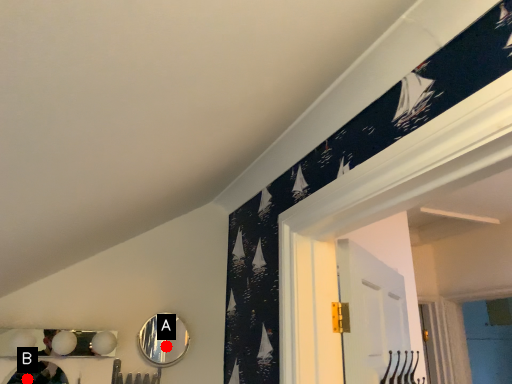
Question: Two points are circled on the image, labeled by A and B beside each circle. Which point is further to the camera?

Choices:
 (A) A is further
 (B) B is further

Answer: (A)